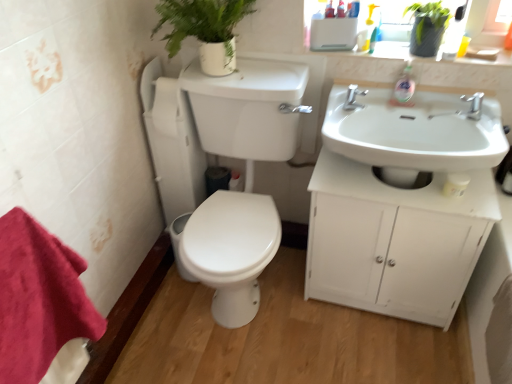
Question: Is green matte plant at upper right, the first plant positioned from the right, positioned behind white glossy sink at right?

Choices:
 (A) no
 (B) yes

Answer: (B)

Question: Is white glossy sink at right a part of green matte plant at upper right, the second plant viewed from the left?

Choices:
 (A) no
 (B) yes

Answer: (A)

Question: Does green matte plant at upper right, the second plant viewed from the left, have a lesser width compared to white glossy sink at right?

Choices:
 (A) no
 (B) yes

Answer: (B)

Question: Does green matte plant at upper right, the first plant positioned from the right, appear on the right side of white glossy sink at right?

Choices:
 (A) yes
 (B) no

Answer: (A)

Question: Is green matte plant at upper right, the first plant positioned from the right, far away from white glossy sink at right?

Choices:
 (A) no
 (B) yes

Answer: (A)

Question: Can you confirm if green matte plant at upper right, the second plant viewed from the left, is taller than white glossy sink at right?

Choices:
 (A) yes
 (B) no

Answer: (B)

Question: From a real-world perspective, is red cotton towel at lower left over white matte cabinet at right?

Choices:
 (A) yes
 (B) no

Answer: (A)

Question: Does red cotton towel at lower left have a lesser width compared to white matte cabinet at right?

Choices:
 (A) yes
 (B) no

Answer: (A)

Question: Is the position of red cotton towel at lower left more distant than that of white matte cabinet at right?

Choices:
 (A) no
 (B) yes

Answer: (A)

Question: Is red cotton towel at lower left far from white matte cabinet at right?

Choices:
 (A) no
 (B) yes

Answer: (A)

Question: Can you confirm if red cotton towel at lower left is positioned to the right of white matte cabinet at right?

Choices:
 (A) yes
 (B) no

Answer: (B)

Question: Is red cotton towel at lower left not inside white matte cabinet at right?

Choices:
 (A) no
 (B) yes

Answer: (B)

Question: Could you tell me if green matte plant at upper center, the 1th plant when ordered from left to right, is turned towards green matte plant at upper right, the first plant positioned from the right?

Choices:
 (A) yes
 (B) no

Answer: (B)